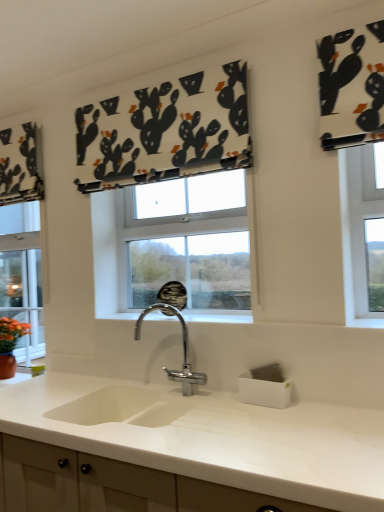
Locate an element on the screen. The height and width of the screenshot is (512, 384). free space above black printed fabric at upper center (from a real-world perspective) is located at coordinates (156, 74).